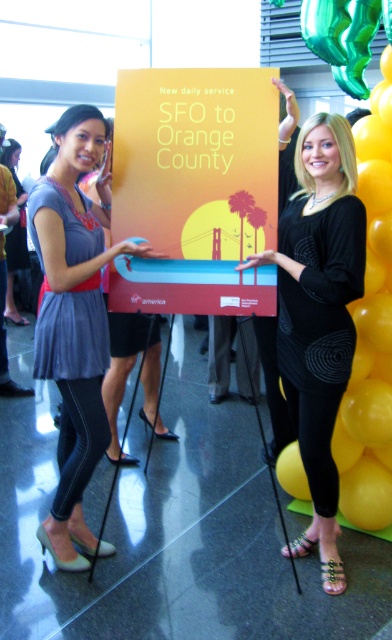
Question: Does black matte dress at center appear on the right side of yellow glossy balloon at upper right?

Choices:
 (A) yes
 (B) no

Answer: (B)

Question: Is black matte dress at center bigger than matte gray dress at center?

Choices:
 (A) yes
 (B) no

Answer: (B)

Question: Which of the following is the closest to the observer?

Choices:
 (A) yellow glossy balloon at upper right
 (B) matte gray dress at center
 (C) black matte dress at center

Answer: (C)

Question: Does black matte dress at center have a smaller size compared to matte gray dress at center?

Choices:
 (A) yes
 (B) no

Answer: (A)

Question: Among these objects, which one is nearest to the camera?

Choices:
 (A) black matte dress at center
 (B) matte gray dress at center

Answer: (A)

Question: Among these points, which one is farthest from the camera?

Choices:
 (A) (297, 416)
 (B) (357, 147)

Answer: (B)